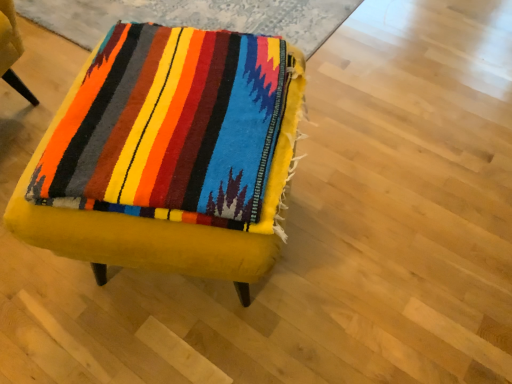
Measure the distance between velvet yellow ottoman at center and camera.

velvet yellow ottoman at center and camera are 33.89 inches apart from each other.

The width and height of the screenshot is (512, 384). Describe the element at coordinates (139, 238) in the screenshot. I see `velvet yellow ottoman at center` at that location.

The height and width of the screenshot is (384, 512). Identify the location of velvet yellow ottoman at center. (139, 238).

What are the coordinates of `velvet yellow ottoman at center` in the screenshot? It's located at (139, 238).